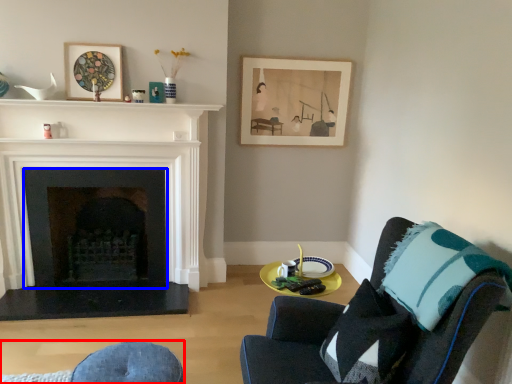
Question: Which object is closer to the camera taking this photo, swivel chair (highlighted by a red box) or fireplace (highlighted by a blue box)?

Choices:
 (A) swivel chair
 (B) fireplace

Answer: (A)